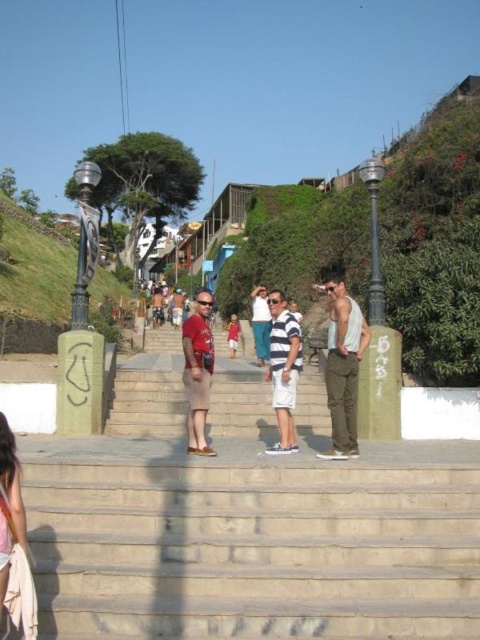
Question: Can you confirm if matte red shirt at center is wider than striped cotton shirt at center?

Choices:
 (A) no
 (B) yes

Answer: (B)

Question: Which object is the closest to the white cotton shirt at center?

Choices:
 (A) matte red shirt at center
 (B) matte red shorts at center
 (C) light brown fabric dress at lower left
 (D) striped cotton shirt at center

Answer: (B)

Question: Is light gray tank top at center wider than white cotton shirt at center?

Choices:
 (A) yes
 (B) no

Answer: (A)

Question: Considering the real-world distances, which object is closest to the light brown fabric dress at lower left?

Choices:
 (A) striped cotton shirt at center
 (B) concrete stairs at center
 (C) matte red shorts at center

Answer: (B)

Question: Can you confirm if striped cotton shirt at center is positioned to the left of white cotton shirt at center?

Choices:
 (A) yes
 (B) no

Answer: (B)

Question: Which object is closer to the camera taking this photo?

Choices:
 (A) light gray tank top at center
 (B) concrete stairs at center

Answer: (B)